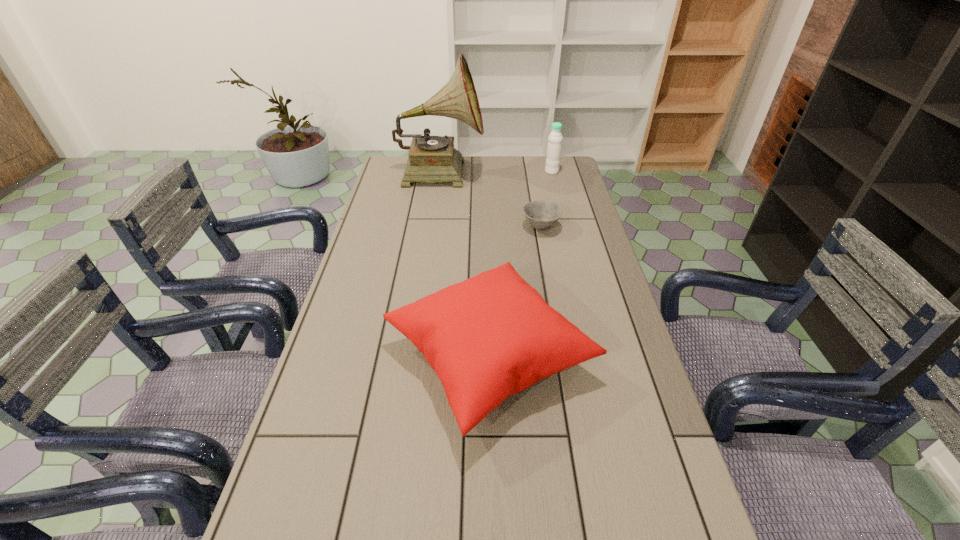
In order to click on the tallest object in this screenshot , I will do `click(431, 159)`.

Locate an element on the screen. The image size is (960, 540). water bottle is located at coordinates (554, 147).

Locate an element on the screen. the second shortest object is located at coordinates (488, 337).

At what (x,y) coordinates should I click in order to perform the action: click on the nearest object. Please return your answer as a coordinate pair (x, y). The width and height of the screenshot is (960, 540). Looking at the image, I should click on (488, 337).

I want to click on the third farthest object, so click(x=541, y=215).

This screenshot has width=960, height=540. I want to click on bowl, so click(x=541, y=215).

Find the location of `vacant space located from the horn of the tallest object`. vacant space located from the horn of the tallest object is located at coordinates (567, 172).

At what (x,y) coordinates should I click in order to perform the action: click on vacant space located on the left of the second tallest object. Please return your answer as a coordinate pair (x, y). Looking at the image, I should click on (497, 172).

What are the coordinates of `free spot located on the right of the nearest object` in the screenshot? It's located at (631, 356).

Identify the location of free spot located 0.210m on the front of the third farthest object. (550, 279).